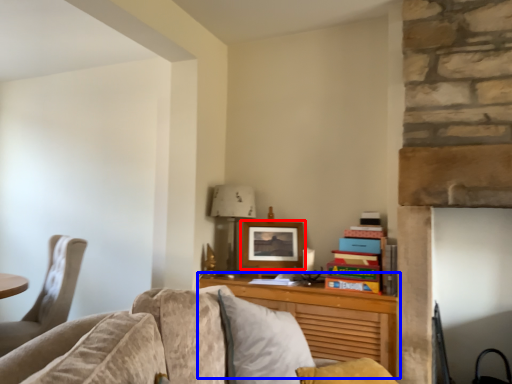
Question: Which object appears closest to the camera in this image, picture frame (highlighted by a red box) or desk (highlighted by a blue box)?

Choices:
 (A) picture frame
 (B) desk

Answer: (B)